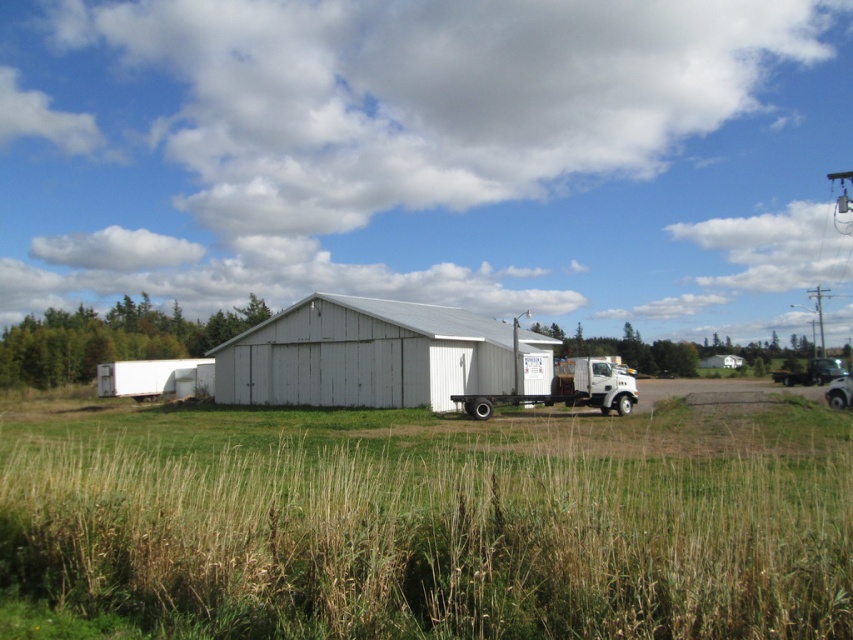
You are a drone operator trying to capture aerial footage of the white matte barn at center. The barn is at coordinates 0.556, 0.427. Your drone is currently at point 0.5, 0.5. In which direction should you move the drone to align it with the barn?

The white matte barn at center is located at point (363, 355). Since the drone is at (426, 320), it needs to move slightly to the right and down to align with the barn.

You are a delivery driver who needs to park your white matte trailer truck at center closer to the white matte barn at center. Based on the scene, can you estimate whether the truck will fit under the barn roof if it were to move directly towards the barn?

The white matte barn at center has a greater height compared to the white matte trailer truck at center, so the truck will fit under the barn roof since the barn is taller than the truck.